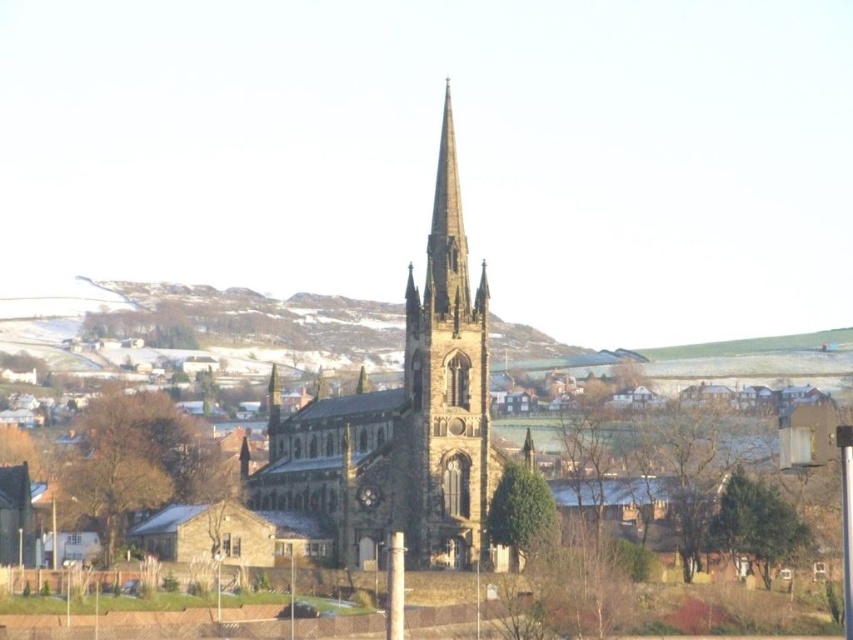
Question: Is brown stone church at center bigger than brown stone tower at center?

Choices:
 (A) yes
 (B) no

Answer: (A)

Question: Is brown stone church at center closer to camera compared to brown stone tower at center?

Choices:
 (A) no
 (B) yes

Answer: (A)

Question: Among these objects, which one is farthest from the camera?

Choices:
 (A) brown stone tower at center
 (B) brown stone church at center

Answer: (B)

Question: Which of the following is the farthest from the observer?

Choices:
 (A) brown stone church at center
 (B) brown stone tower at center

Answer: (A)

Question: Is brown stone church at center smaller than brown stone tower at center?

Choices:
 (A) no
 (B) yes

Answer: (A)